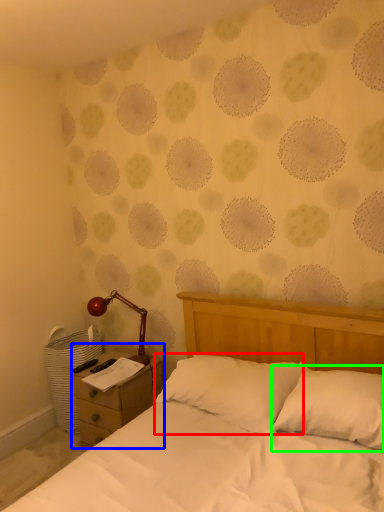
Question: Which object is positioned farthest from pillow (highlighted by a red box)? Select from nightstand (highlighted by a blue box) and pillow (highlighted by a green box).

Choices:
 (A) nightstand
 (B) pillow

Answer: (A)